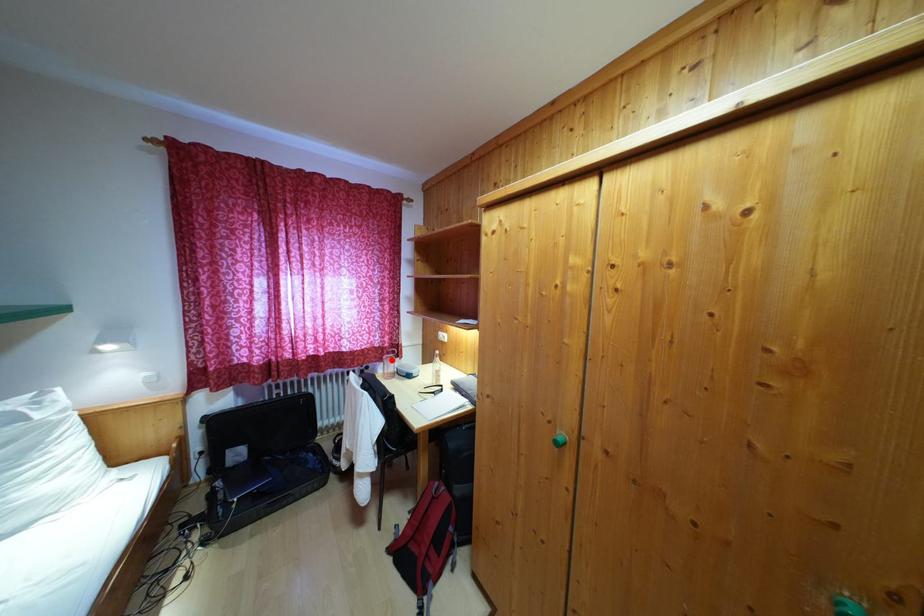
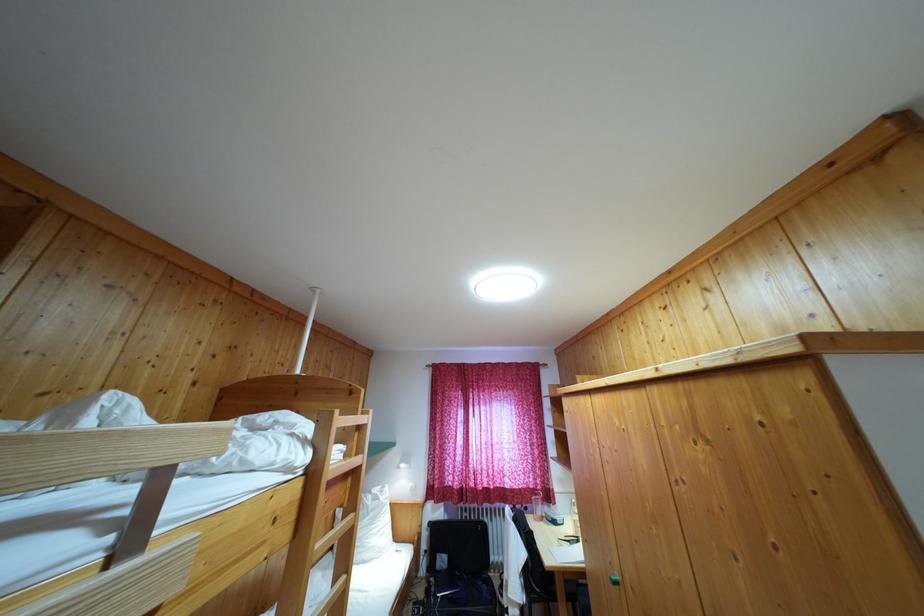
Question: I am providing you with two images of the same scene from different viewpoints. A red point is shown in image1. For the corresponding object point in image2, is it positioned nearer or farther from the camera?

Choices:
 (A) Nearer
 (B) Farther

Answer: (B)